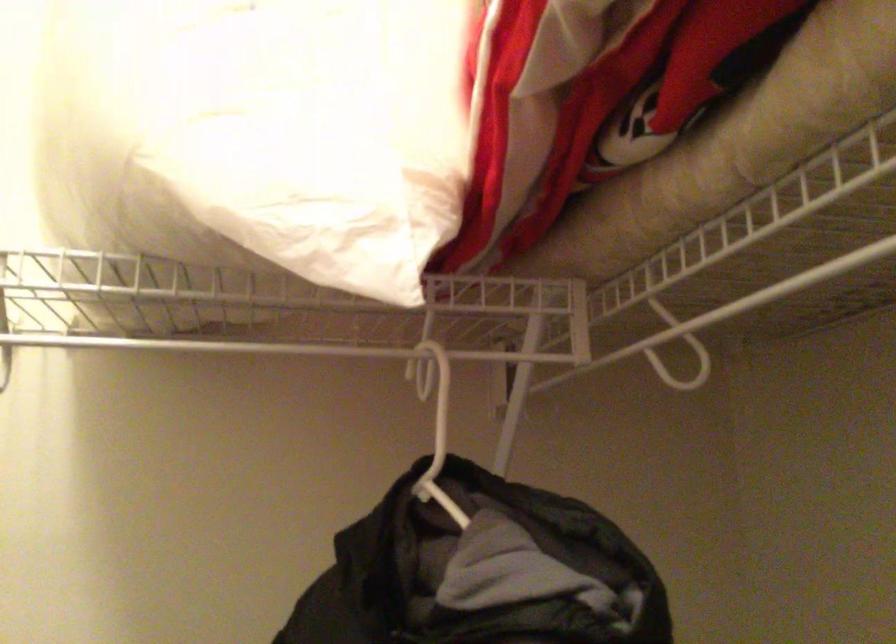
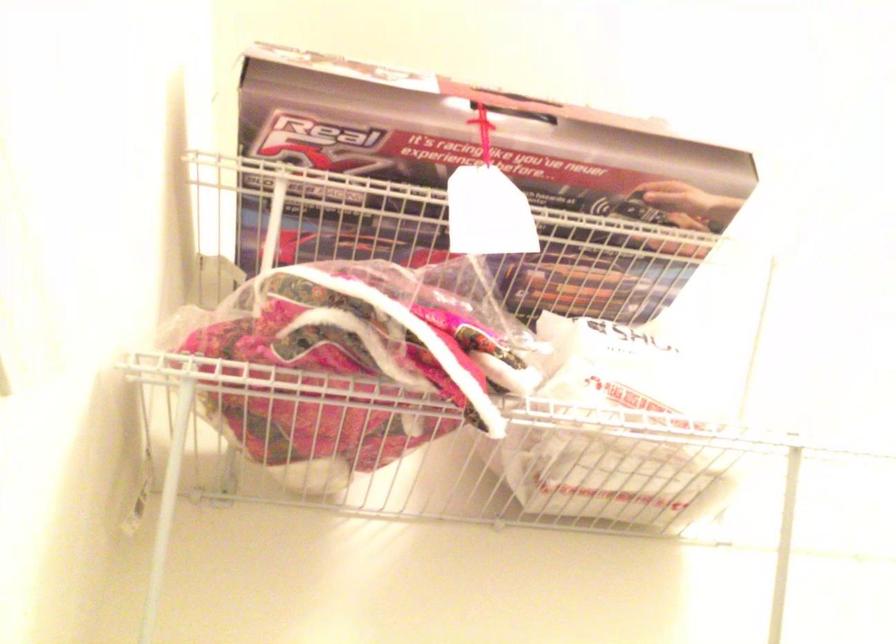
Question: How did the camera likely rotate?

Choices:
 (A) Left
 (B) Right
 (C) Up
 (D) Down

Answer: (C)